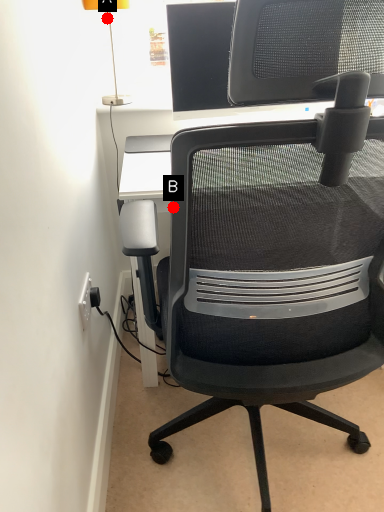
Question: Two points are circled on the image, labeled by A and B beside each circle. Among these points, which one is nearest to the camera?

Choices:
 (A) A is closer
 (B) B is closer

Answer: (B)